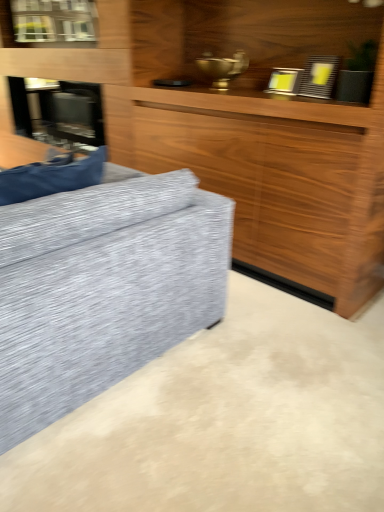
The height and width of the screenshot is (512, 384). Describe the element at coordinates (58, 112) in the screenshot. I see `stainless steel fireplace at left` at that location.

You are a GUI agent. You are given a task and a screenshot of the screen. Output one action in this format:
    pyautogui.click(x=<x>, y=<y>)
    Task: Click on the clear glass window at upper left
    Image resolution: width=384 pixels, height=512 pixels.
    Given the screenshot: What is the action you would take?
    pyautogui.click(x=54, y=21)

From the image's perspective, is clear glass window at upper left beneath wooden cabinet at center?

Actually, clear glass window at upper left appears above wooden cabinet at center in the image.

Considering the points (27, 23) and (267, 172), which point is in front, point (27, 23) or point (267, 172)?

The point (267, 172) is closer to the camera.

Based on the photo, is clear glass window at upper left next to wooden cabinet at center and touching it?

clear glass window at upper left and wooden cabinet at center are clearly separated.

In the scene shown: Measure the distance from wooden cabinet at center to clear glass window at upper left.

A distance of 36.62 inches exists between wooden cabinet at center and clear glass window at upper left.

From the image's perspective, between wooden cabinet at center and clear glass window at upper left, who is located below?

wooden cabinet at center is shown below in the image.

Is there a large distance between wooden cabinet at center and clear glass window at upper left?

wooden cabinet at center is near clear glass window at upper left, not far away.

Which of these two, wooden cabinet at center or clear glass window at upper left, stands taller?

wooden cabinet at center.

Is stainless steel fireplace at left touching clear glass window at upper left?

No, stainless steel fireplace at left is not with clear glass window at upper left.

Does stainless steel fireplace at left have a greater width compared to clear glass window at upper left?

Yes, stainless steel fireplace at left is wider than clear glass window at upper left.

Choose the correct answer: Is stainless steel fireplace at left inside clear glass window at upper left or outside it?

stainless steel fireplace at left is spatially situated outside clear glass window at upper left.

Where is `window in front of the stainless steel fireplace at left`? window in front of the stainless steel fireplace at left is located at coordinates (54, 21).

Considering the sizes of clear glass window at upper left and stainless steel fireplace at left in the image, is clear glass window at upper left wider or thinner than stainless steel fireplace at left?

In the image, clear glass window at upper left appears to be more narrow than stainless steel fireplace at left.

From the image's perspective, which object appears higher, clear glass window at upper left or stainless steel fireplace at left?

clear glass window at upper left is shown above in the image.

Is stainless steel fireplace at left at the back of clear glass window at upper left?

No, clear glass window at upper left's orientation is not away from stainless steel fireplace at left.

Considering the relative sizes of stainless steel fireplace at left and wooden cabinet at center in the image provided, is stainless steel fireplace at left bigger than wooden cabinet at center?

No.

Is stainless steel fireplace at left at the right side of wooden cabinet at center?

Incorrect, stainless steel fireplace at left is not on the right side of wooden cabinet at center.

From the image's perspective, is stainless steel fireplace at left above or below wooden cabinet at center?

Clearly, from the image's perspective, stainless steel fireplace at left is below wooden cabinet at center.

Is the position of stainless steel fireplace at left more distant than that of wooden cabinet at center?

Yes, stainless steel fireplace at left is further from the camera.

Is wooden cabinet at center placed right next to stainless steel fireplace at left?

There is a gap between wooden cabinet at center and stainless steel fireplace at left.

Considering the sizes of wooden cabinet at center and stainless steel fireplace at left in the image, is wooden cabinet at center taller or shorter than stainless steel fireplace at left?

Clearly, wooden cabinet at center is taller compared to stainless steel fireplace at left.

What's the angular difference between wooden cabinet at center and stainless steel fireplace at left's facing directions?

The angular difference between wooden cabinet at center and stainless steel fireplace at left is 0.457 degrees.

In terms of size, does wooden cabinet at center appear bigger or smaller than stainless steel fireplace at left?

wooden cabinet at center is bigger than stainless steel fireplace at left.

At what (x,y) coordinates should I click in order to perform the action: click on window lying above the wooden cabinet at center (from the image's perspective). Please return your answer as a coordinate pair (x, y). Looking at the image, I should click on (54, 21).

The width and height of the screenshot is (384, 512). I want to click on cabinetry located on the right of clear glass window at upper left, so click(245, 126).

Based on their spatial positions, is clear glass window at upper left or wooden cabinet at center further from stainless steel fireplace at left?

Among the two, wooden cabinet at center is located further to stainless steel fireplace at left.

When comparing their distances from clear glass window at upper left, does wooden cabinet at center or stainless steel fireplace at left seem closer?

Based on the image, stainless steel fireplace at left appears to be nearer to clear glass window at upper left.

Based on their spatial positions, is stainless steel fireplace at left or clear glass window at upper left further from wooden cabinet at center?

clear glass window at upper left is further to wooden cabinet at center.

Based on the photo, which object lies further to the anchor point clear glass window at upper left, stainless steel fireplace at left or wooden cabinet at center?

wooden cabinet at center lies further to clear glass window at upper left than the other object.

Looking at the image, which one is located closer to stainless steel fireplace at left, wooden cabinet at center or clear glass window at upper left?

clear glass window at upper left is closer to stainless steel fireplace at left.

From the image, which object appears to be nearer to wooden cabinet at center, clear glass window at upper left or stainless steel fireplace at left?

Based on the image, stainless steel fireplace at left appears to be nearer to wooden cabinet at center.

Image resolution: width=384 pixels, height=512 pixels. Find the location of `window positioned between wooden cabinet at center and stainless steel fireplace at left from near to far`. window positioned between wooden cabinet at center and stainless steel fireplace at left from near to far is located at coordinates (54, 21).